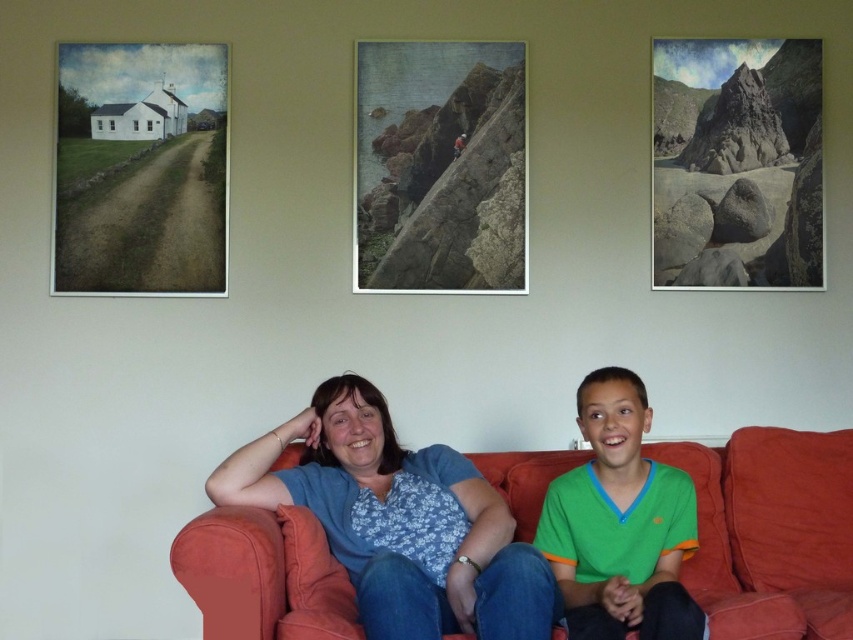
Question: Which of the following is the farthest from the observer?

Choices:
 (A) (515, 92)
 (B) (369, 461)
 (C) (834, 464)
 (D) (619, 520)

Answer: (A)

Question: Does matte paper landscape at left have a larger size compared to smooth stone cliff at center?

Choices:
 (A) yes
 (B) no

Answer: (A)

Question: Does velvet orange couch at center lie behind smooth stone cliff at center?

Choices:
 (A) no
 (B) yes

Answer: (A)

Question: Which point is farther to the camera?

Choices:
 (A) (805, 289)
 (B) (53, 237)

Answer: (A)

Question: Which point appears closest to the camera in this image?

Choices:
 (A) (82, 156)
 (B) (624, 413)
 (C) (779, 48)
 (D) (781, 502)

Answer: (B)

Question: From the image, what is the correct spatial relationship of velvet orange couch at center in relation to smooth stone cliff at center?

Choices:
 (A) above
 (B) below

Answer: (B)